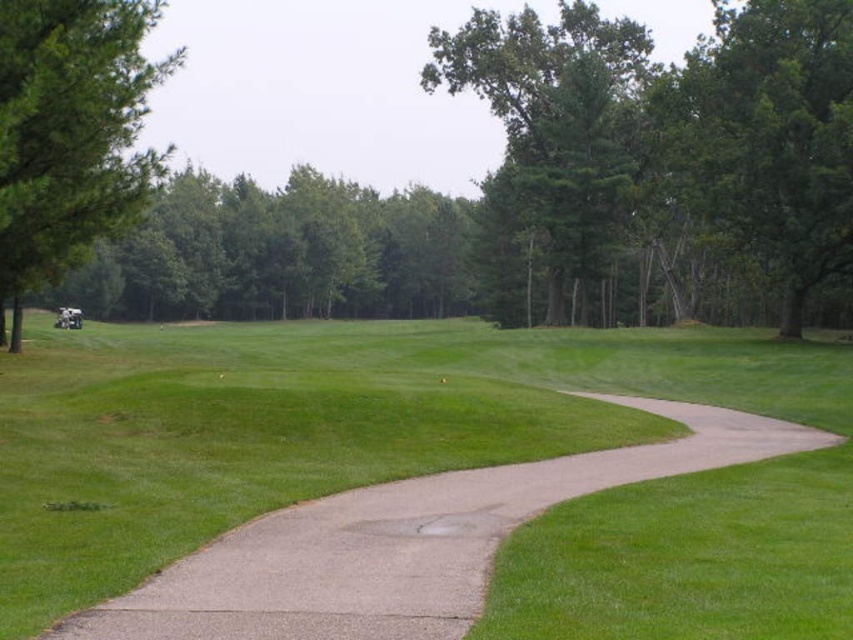
Does green grass at lower left have a lesser height compared to green leafy tree at center?

Yes, green grass at lower left is shorter than green leafy tree at center.

Between point (786, 452) and point (569, 97), which one is positioned behind?

The point (569, 97) is behind.

The width and height of the screenshot is (853, 640). What are the coordinates of `green grass at lower left` in the screenshot? It's located at (405, 541).

Does green leafy tree at upper center lie in front of green leafy tree at center?

Yes, green leafy tree at upper center is in front of green leafy tree at center.

Locate an element on the screen. green leafy tree at upper center is located at coordinates (283, 253).

Does green grass at lower left appear under green leafy tree at upper center?

Yes.

Between point (373, 636) and point (283, 218), which one is positioned in front?

Point (373, 636) is in front.

Is point (213, 563) behind point (109, 244)?

No, (213, 563) is closer to viewer.

Identify the location of green grass at lower left. (405, 541).